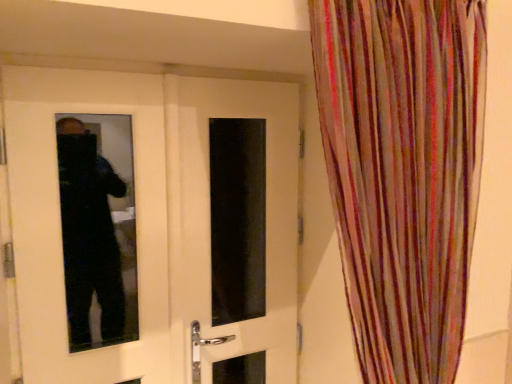
Question: Relative to white glossy door at center, the 2th door in the right-to-left sequence, is multicolored sheer curtain at right in front or behind?

Choices:
 (A) behind
 (B) front

Answer: (B)

Question: In terms of width, does multicolored sheer curtain at right look wider or thinner when compared to white glossy door at center, which appears as the 1th door when viewed from the left?

Choices:
 (A) wide
 (B) thin

Answer: (A)

Question: Considering the real-world distances, which object is farthest from the white glossy door at center, which is counted as the first door, starting from the right?

Choices:
 (A) multicolored sheer curtain at right
 (B) white glossy door at center, the 2th door in the right-to-left sequence

Answer: (A)

Question: Which is farther from the white glossy door at center, which appears as the 1th door when viewed from the left?

Choices:
 (A) multicolored sheer curtain at right
 (B) white glossy door at center, the 2th door positioned from the left

Answer: (A)